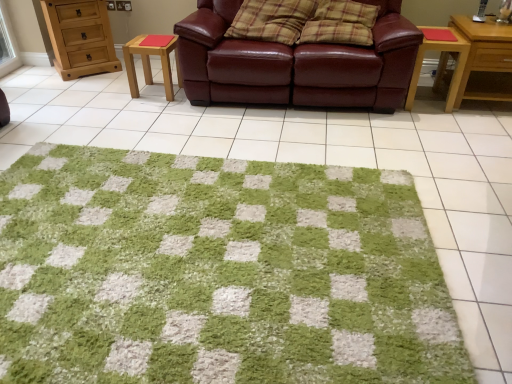
The height and width of the screenshot is (384, 512). I want to click on green shaggy rug at center, so click(217, 273).

Find the location of a particular element. light brown wood nightstand at right is located at coordinates (484, 55).

This screenshot has height=384, width=512. Identify the location of plaid fabric pillow at center, the first pillow when ordered from right to left. coord(340,23).

Find the location of a particular element. The width and height of the screenshot is (512, 384). wooden side table at right, the second table viewed from the left is located at coordinates (443, 53).

The width and height of the screenshot is (512, 384). What do you see at coordinates (272, 20) in the screenshot? I see `plaid fabric pillow at center, which is counted as the 1th pillow, starting from the left` at bounding box center [272, 20].

Where is `light brown wooden chest of drawers at upper left`? This screenshot has height=384, width=512. light brown wooden chest of drawers at upper left is located at coordinates pos(80,37).

Identify the location of green shaggy rug at center. The image size is (512, 384). (217, 273).

Is light brown wood nightstand at right positioned with its back to wooden stool at center-left, the 2th table from the right?

No, light brown wood nightstand at right is not facing away from wooden stool at center-left, the 2th table from the right.

Are light brown wood nightstand at right and wooden stool at center-left, the 2th table from the right, far apart?

Yes, light brown wood nightstand at right and wooden stool at center-left, the 2th table from the right, are quite far apart.

From the image's perspective, between light brown wood nightstand at right and wooden stool at center-left, the first table positioned from the left, who is located below?

light brown wood nightstand at right is shown below in the image.

Looking at this image, are wooden stool at center-left, the 2th table from the right, and plaid fabric pillow at center, the first pillow when ordered from right to left, far apart?

Yes.

Considering the relative sizes of wooden stool at center-left, the 2th table from the right, and plaid fabric pillow at center, the first pillow when ordered from right to left, in the image provided, is wooden stool at center-left, the 2th table from the right, taller than plaid fabric pillow at center, the first pillow when ordered from right to left,?

Incorrect, the height of wooden stool at center-left, the 2th table from the right, is not larger of that of plaid fabric pillow at center, the first pillow when ordered from right to left.

Can you confirm if wooden stool at center-left, the first table positioned from the left, is wider than plaid fabric pillow at center, the first pillow when ordered from right to left?

No.

From a real-world perspective, which object rests below the other?

In real-world perspective, wooden stool at center-left, the 2th table from the right, is lower.

You are a GUI agent. You are given a task and a screenshot of the screen. Output one action in this format:
    pyautogui.click(x=<x>, y=<y>)
    Task: Click on the table lying behind the wooden side table at right, the second table viewed from the left
    Image resolution: width=512 pixels, height=384 pixels.
    Given the screenshot: What is the action you would take?
    pyautogui.click(x=150, y=64)

From the image's perspective, which is below, wooden side table at right, which is the first table in right-to-left order, or wooden stool at center-left, the 2th table from the right?

wooden side table at right, which is the first table in right-to-left order, from the image's perspective.

Measure the distance between leather couch at center and green shaggy rug at center.

leather couch at center and green shaggy rug at center are 4.72 feet apart.

Considering the sizes of objects leather couch at center and green shaggy rug at center in the image provided, who is wider, leather couch at center or green shaggy rug at center?

Wider between the two is green shaggy rug at center.

In terms of height, does leather couch at center look taller or shorter compared to green shaggy rug at center?

leather couch at center is taller than green shaggy rug at center.

Does point (105, 2) come farther from viewer compared to point (359, 250)?

Yes, point (105, 2) is farther from viewer.

From the image's perspective, is light brown wooden chest of drawers at upper left on green shaggy rug at center?

Yes, from the image's perspective, light brown wooden chest of drawers at upper left is over green shaggy rug at center.

Would you say light brown wooden chest of drawers at upper left is inside or outside green shaggy rug at center?

light brown wooden chest of drawers at upper left is located beyond the bounds of green shaggy rug at center.

Can you see light brown wooden chest of drawers at upper left touching green shaggy rug at center?

light brown wooden chest of drawers at upper left is not next to green shaggy rug at center, and they're not touching.

Based on the photo, looking at their sizes, would you say plaid fabric pillow at center, the first pillow when ordered from right to left, is wider or thinner than leather couch at center?

Clearly, plaid fabric pillow at center, the first pillow when ordered from right to left, has less width compared to leather couch at center.

From a real-world perspective, is plaid fabric pillow at center, positioned as the 2th pillow in left-to-right order, above or below leather couch at center?

plaid fabric pillow at center, positioned as the 2th pillow in left-to-right order, is situated higher than leather couch at center in the real world.

Locate an element on the screen. studio couch that appears in front of the plaid fabric pillow at center, the first pillow when ordered from right to left is located at coordinates (296, 63).

Is there a large distance between plaid fabric pillow at center, the first pillow when ordered from right to left, and leather couch at center?

plaid fabric pillow at center, the first pillow when ordered from right to left, is near leather couch at center, not far away.

In the image, there is a plaid fabric pillow at center, placed as the second pillow when sorted from right to left. In order to click on mat below it (from the image's perspective) in this screenshot , I will do `click(217, 273)`.

From a real-world perspective, is plaid fabric pillow at center, placed as the second pillow when sorted from right to left, above or below green shaggy rug at center?

plaid fabric pillow at center, placed as the second pillow when sorted from right to left, is above green shaggy rug at center.

Does plaid fabric pillow at center, placed as the second pillow when sorted from right to left, have a lesser width compared to green shaggy rug at center?

Yes.

Can you tell me how much plaid fabric pillow at center, which is counted as the 1th pillow, starting from the left, and green shaggy rug at center differ in facing direction?

The angle between the facing direction of plaid fabric pillow at center, which is counted as the 1th pillow, starting from the left, and the facing direction of green shaggy rug at center is 5.6 degrees.

Image resolution: width=512 pixels, height=384 pixels. Identify the location of nightstand on the right of wooden stool at center-left, the first table positioned from the left. (484, 55).

Identify the location of table on the left of plaid fabric pillow at center, positioned as the 2th pillow in left-to-right order. (150, 64).

When comparing their distances from light brown wood nightstand at right, does green shaggy rug at center or wooden stool at center-left, the 2th table from the right, seem further?

wooden stool at center-left, the 2th table from the right, lies further to light brown wood nightstand at right than the other object.

From the image, which object appears to be farther from plaid fabric pillow at center, which is counted as the 1th pillow, starting from the left, wooden stool at center-left, the first table positioned from the left, or light brown wood nightstand at right?

The object further to plaid fabric pillow at center, which is counted as the 1th pillow, starting from the left, is light brown wood nightstand at right.

Looking at the image, which one is located further to plaid fabric pillow at center, which is counted as the 1th pillow, starting from the left, light brown wooden chest of drawers at upper left or leather couch at center?

light brown wooden chest of drawers at upper left is positioned further to the anchor plaid fabric pillow at center, which is counted as the 1th pillow, starting from the left.

Which object lies nearer to the anchor point wooden side table at right, which is the first table in right-to-left order, wooden stool at center-left, the 2th table from the right, or green shaggy rug at center?

green shaggy rug at center.

Which object lies nearer to the anchor point green shaggy rug at center, plaid fabric pillow at center, positioned as the 2th pillow in left-to-right order, or leather couch at center?

leather couch at center is closer to green shaggy rug at center.

Looking at the image, which one is located closer to plaid fabric pillow at center, the first pillow when ordered from right to left, light brown wood nightstand at right or green shaggy rug at center?

light brown wood nightstand at right is closer to plaid fabric pillow at center, the first pillow when ordered from right to left.

When comparing their distances from light brown wooden chest of drawers at upper left, does plaid fabric pillow at center, which is counted as the 1th pillow, starting from the left, or plaid fabric pillow at center, the first pillow when ordered from right to left, seem closer?

The object closer to light brown wooden chest of drawers at upper left is plaid fabric pillow at center, which is counted as the 1th pillow, starting from the left.

Which object lies further to the anchor point light brown wood nightstand at right, light brown wooden chest of drawers at upper left or plaid fabric pillow at center, positioned as the 2th pillow in left-to-right order?

light brown wooden chest of drawers at upper left lies further to light brown wood nightstand at right than the other object.

The width and height of the screenshot is (512, 384). Find the location of `mat between wooden stool at center-left, the 2th table from the right, and wooden side table at right, the second table viewed from the left`. mat between wooden stool at center-left, the 2th table from the right, and wooden side table at right, the second table viewed from the left is located at coordinates (217, 273).

Where is `studio couch between green shaggy rug at center and wooden side table at right, the second table viewed from the left, along the z-axis`? studio couch between green shaggy rug at center and wooden side table at right, the second table viewed from the left, along the z-axis is located at coordinates (296, 63).

Identify the location of studio couch between wooden stool at center-left, the 2th table from the right, and wooden side table at right, which is the first table in right-to-left order, in the horizontal direction. (296, 63).

The height and width of the screenshot is (384, 512). I want to click on table between green shaggy rug at center and light brown wood nightstand at right in the horizontal direction, so click(443, 53).